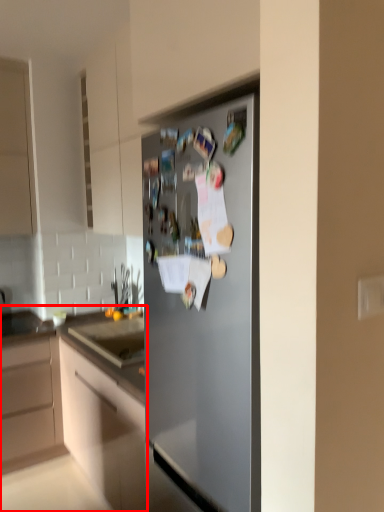
Question: From the image's perspective, what is the correct spatial relationship of cabinetry (annotated by the red box) in relation to refrigerator?

Choices:
 (A) above
 (B) below

Answer: (B)